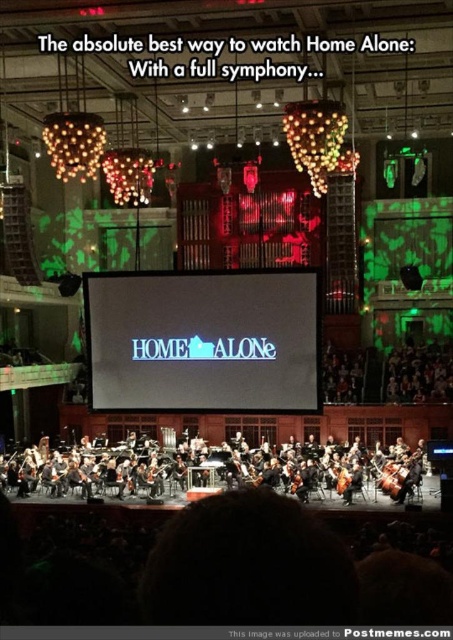
Question: Which point appears closest to the camera in this image?

Choices:
 (A) (159, 476)
 (B) (100, 470)
 (C) (154, 333)

Answer: (C)

Question: Based on their relative distances, which object is nearer to the matte black cello at center?

Choices:
 (A) black glossy orchestra at center
 (B) blue glossy screen at center

Answer: (A)

Question: Is black glossy orchestra at center to the left of matte black cello at center from the viewer's perspective?

Choices:
 (A) yes
 (B) no

Answer: (B)

Question: Can you confirm if black glossy orchestra at center is positioned below matte black cello at center?

Choices:
 (A) no
 (B) yes

Answer: (A)

Question: Among these points, which one is farthest from the camera?

Choices:
 (A) (302, 300)
 (B) (155, 474)
 (C) (193, 451)

Answer: (C)

Question: Does black glossy orchestra at center have a larger size compared to matte black cello at center?

Choices:
 (A) yes
 (B) no

Answer: (A)